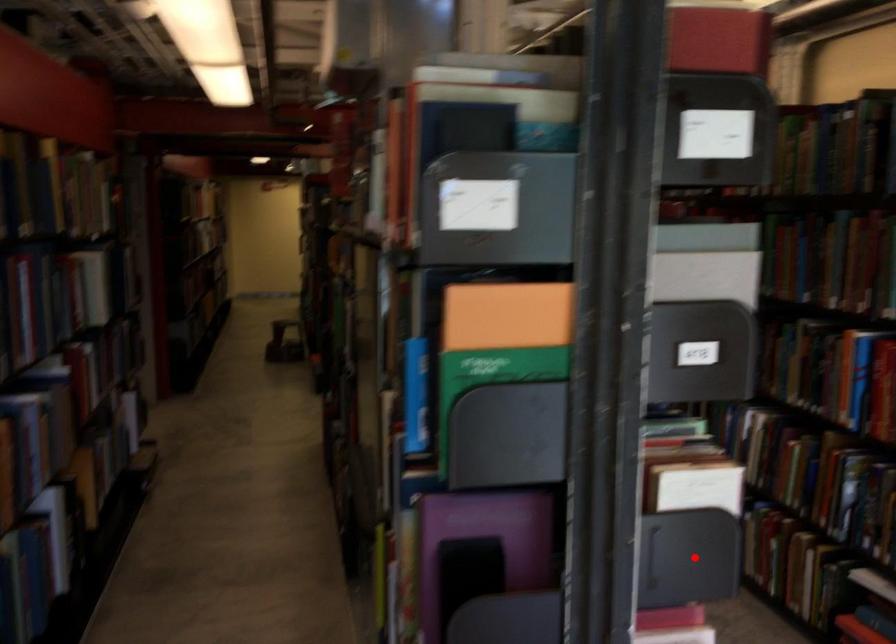
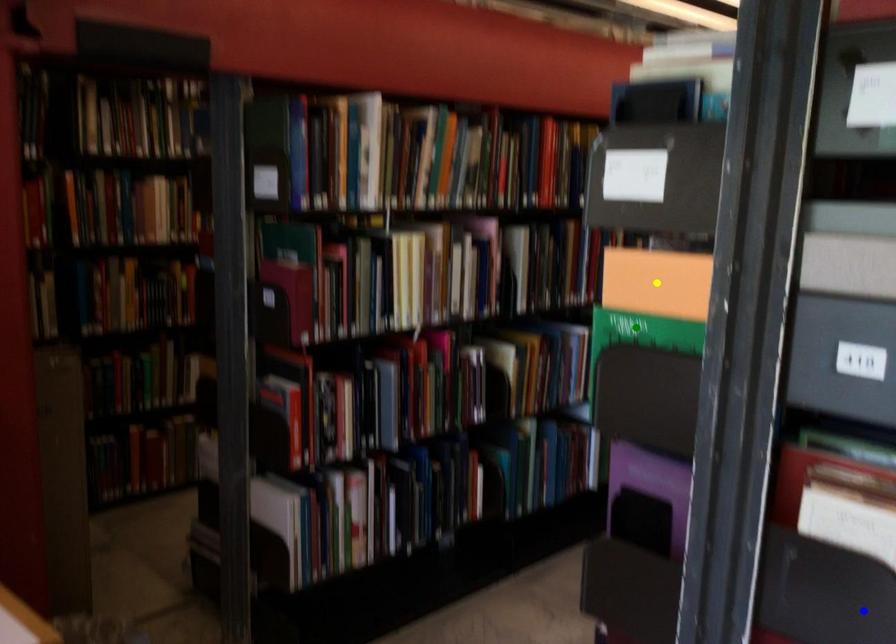
Question: I am providing you with two images of the same scene from different viewpoints. A red point is marked on the first image. You are given multiple points on the second image. Which mark in image 2 goes with the point in image 1?

Choices:
 (A) blue point
 (B) green point
 (C) yellow point

Answer: (A)